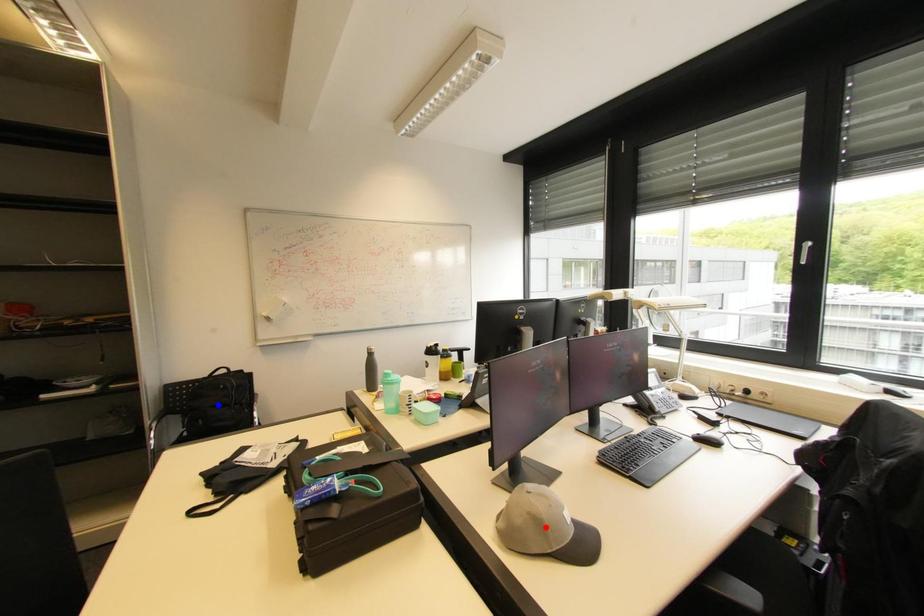
Question: Two points are marked on the image. Which point is closer to the camera?

Choices:
 (A) Blue point is closer.
 (B) Red point is closer.

Answer: (B)